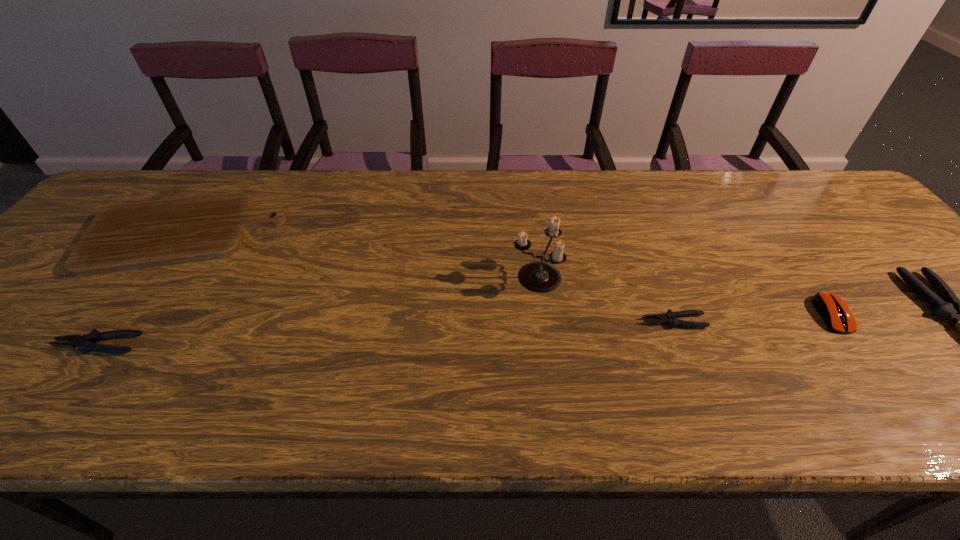
The height and width of the screenshot is (540, 960). Identify the location of the leftmost pliers. (85, 343).

At what (x,y) coordinates should I click in order to perform the action: click on the third object from right to left. Please return your answer as a coordinate pair (x, y). Image resolution: width=960 pixels, height=540 pixels. Looking at the image, I should click on (670, 318).

The height and width of the screenshot is (540, 960). In order to click on the shortest object in this screenshot , I will do `click(670, 318)`.

Where is `chopping board`? This screenshot has width=960, height=540. chopping board is located at coordinates (129, 236).

Find the location of a particular element. The height and width of the screenshot is (540, 960). the tallest object is located at coordinates pos(540,277).

The width and height of the screenshot is (960, 540). Find the location of `candle holder`. candle holder is located at coordinates (540, 277).

You are a GUI agent. You are given a task and a screenshot of the screen. Output one action in this format:
    pyautogui.click(x=<x>, y=<y>)
    Task: Click on the computer mouse
    
    Given the screenshot: What is the action you would take?
    pyautogui.click(x=832, y=308)

In order to click on free space located 0.050m at the gripping part of the leftmost pliers in this screenshot , I will do `click(33, 345)`.

Locate an element on the screen. This screenshot has width=960, height=540. free region located at the gripping part of the shortest object is located at coordinates (520, 321).

Locate an element on the screen. vacant space located 0.310m at the gripping part of the shortest object is located at coordinates (502, 321).